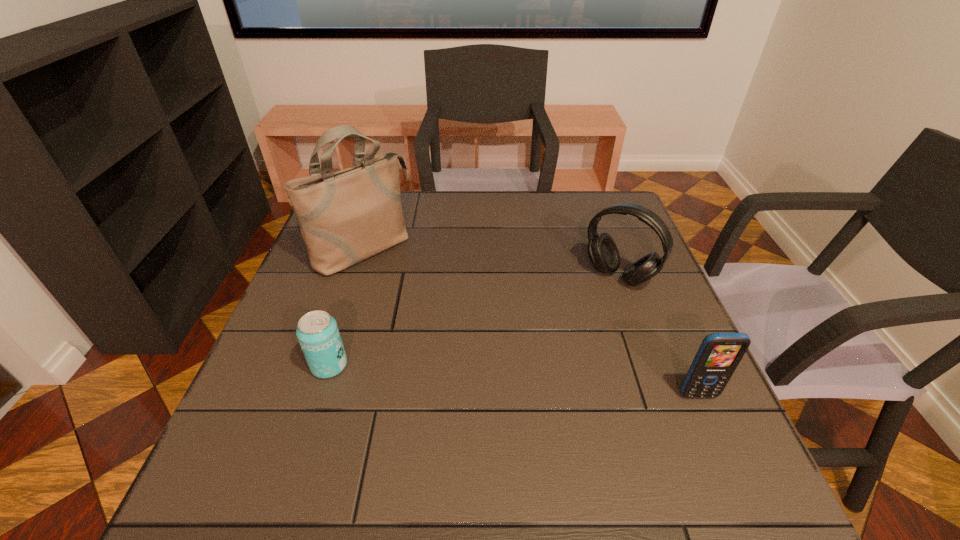
You are a GUI agent. You are given a task and a screenshot of the screen. Output one action in this format:
    pyautogui.click(x=<x>, y=<y>)
    Task: Click on the vacant space located on the earcups of the headset
    This screenshot has width=960, height=540.
    Given the screenshot: What is the action you would take?
    pyautogui.click(x=571, y=330)

Locate an element on the screen. The height and width of the screenshot is (540, 960). free location located on the earcups of the headset is located at coordinates (519, 392).

Identify the location of object present at the far edge. point(347,216).

Find the location of `beer can located in the left edge section of the desktop`. beer can located in the left edge section of the desktop is located at coordinates (317, 332).

Locate an element on the screen. This screenshot has height=540, width=960. shoulder bag that is at the left edge is located at coordinates (347, 216).

This screenshot has height=540, width=960. What are the coordinates of `cellular telephone present at the right edge` in the screenshot? It's located at (719, 354).

Where is `headset present at the right edge`? headset present at the right edge is located at coordinates (603, 253).

Where is `object that is at the far left corner`? object that is at the far left corner is located at coordinates (347, 216).

Image resolution: width=960 pixels, height=540 pixels. In the image, there is a desktop. Identify the location of vacant space at the far edge. click(x=407, y=226).

In the image, there is a desktop. Identify the location of free region at the near edge. (460, 418).